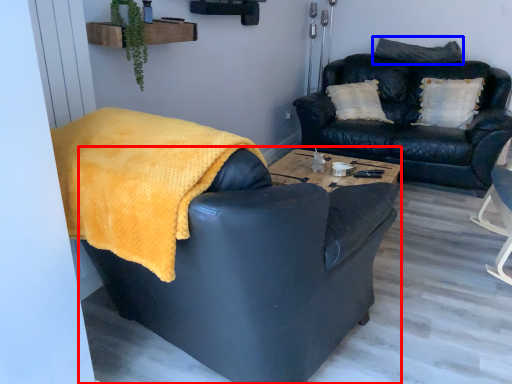
Question: Among these objects, which one is nearest to the camera, chair (highlighted by a red box) or pillow (highlighted by a blue box)?

Choices:
 (A) chair
 (B) pillow

Answer: (A)